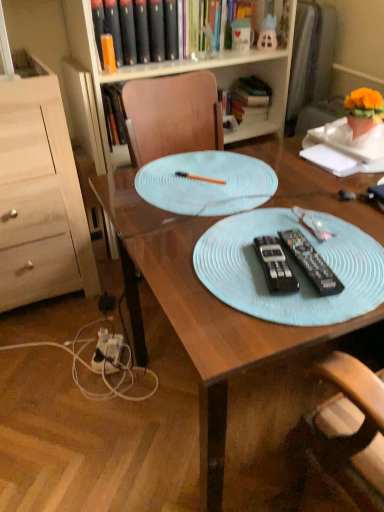
The width and height of the screenshot is (384, 512). Find the location of `blank area to the left of white plastic power outlet at lower left`. blank area to the left of white plastic power outlet at lower left is located at coordinates (63, 356).